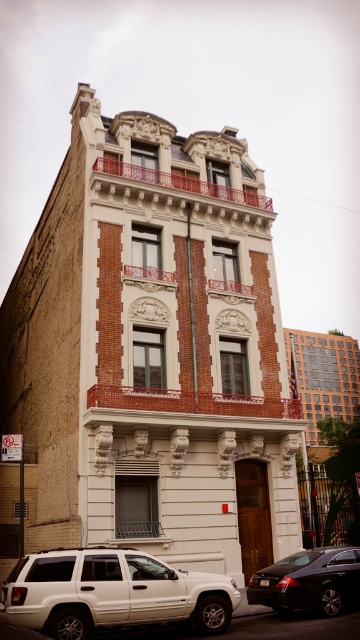
You are standing in front of the building and see a point marked at coordinates (111, 593). According to the image, what object is located at that point?

The point at coordinates (111, 593) marks the white matte suv at lower left.

You are a delivery person needing to park your van between the white matte suv at lower left and the shiny black sedan at lower right. Your van is 6 meters long. Can you safely park your van between them without touching either vehicle?

The distance between the white matte suv at lower left and the shiny black sedan at lower right is 6.78 meters. Since your van is 6 meters long, there is enough space to park safely between them without touching either vehicle.

What is the exact coordinate of the white matte suv at lower left?

The white matte suv at lower left is located at coordinate point (111, 593).